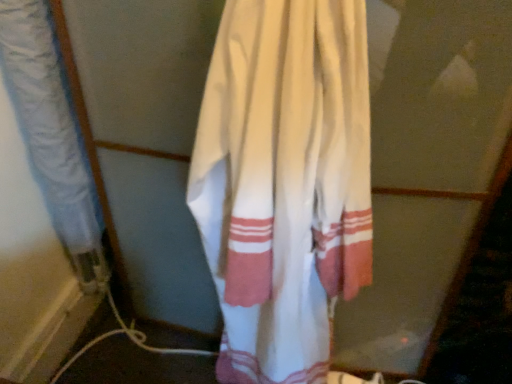
Question: Does white cotton towel at left, the 1th curtain viewed from the left, turn towards white cotton towel at center, acting as the first curtain starting from the right?

Choices:
 (A) no
 (B) yes

Answer: (A)

Question: Is the position of white cotton towel at left, the 1th curtain viewed from the left, more distant than that of white cotton towel at center, placed as the 2th curtain when sorted from left to right?

Choices:
 (A) no
 (B) yes

Answer: (B)

Question: Can you confirm if white cotton towel at left, the second curtain viewed from the right, is shorter than white cotton towel at center, acting as the first curtain starting from the right?

Choices:
 (A) yes
 (B) no

Answer: (A)

Question: Is white cotton towel at left, the second curtain viewed from the right, beside white cotton towel at center, acting as the first curtain starting from the right?

Choices:
 (A) yes
 (B) no

Answer: (B)

Question: Is white cotton towel at left, the 1th curtain viewed from the left, far away from white cotton towel at center, acting as the first curtain starting from the right?

Choices:
 (A) no
 (B) yes

Answer: (A)

Question: Would you say white cotton towel at center, placed as the 2th curtain when sorted from left to right, is part of white cotton towel at left, the 1th curtain viewed from the left,'s contents?

Choices:
 (A) no
 (B) yes

Answer: (A)

Question: From the image's perspective, is white cotton towel at center, placed as the 2th curtain when sorted from left to right, below white cotton towel at left, the 1th curtain viewed from the left?

Choices:
 (A) yes
 (B) no

Answer: (A)

Question: Considering the relative positions of white cotton towel at center, acting as the first curtain starting from the right, and white cotton towel at left, the second curtain viewed from the right, in the image provided, is white cotton towel at center, acting as the first curtain starting from the right, behind white cotton towel at left, the second curtain viewed from the right,?

Choices:
 (A) yes
 (B) no

Answer: (B)

Question: Considering the relative sizes of white cotton towel at center, placed as the 2th curtain when sorted from left to right, and white cotton towel at left, the second curtain viewed from the right, in the image provided, is white cotton towel at center, placed as the 2th curtain when sorted from left to right, bigger than white cotton towel at left, the second curtain viewed from the right,?

Choices:
 (A) no
 (B) yes

Answer: (B)

Question: Is white cotton towel at center, acting as the first curtain starting from the right, surrounding white cotton towel at left, the 1th curtain viewed from the left?

Choices:
 (A) no
 (B) yes

Answer: (A)

Question: Is white cotton towel at center, acting as the first curtain starting from the right, not near white cotton towel at left, the 1th curtain viewed from the left?

Choices:
 (A) no
 (B) yes

Answer: (A)

Question: Does white cotton towel at center, placed as the 2th curtain when sorted from left to right, appear on the left side of white cotton towel at left, the second curtain viewed from the right?

Choices:
 (A) yes
 (B) no

Answer: (B)

Question: From the image's perspective, is white cotton towel at left, the 1th curtain viewed from the left, positioned above or below white cotton towel at center, placed as the 2th curtain when sorted from left to right?

Choices:
 (A) above
 (B) below

Answer: (A)